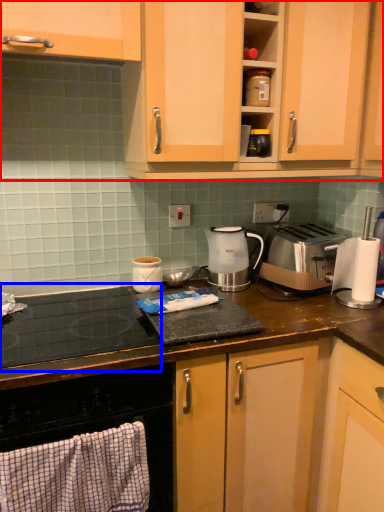
Question: Which object is closer to the camera taking this photo, cabinetry (highlighted by a red box) or gas stove (highlighted by a blue box)?

Choices:
 (A) cabinetry
 (B) gas stove

Answer: (B)